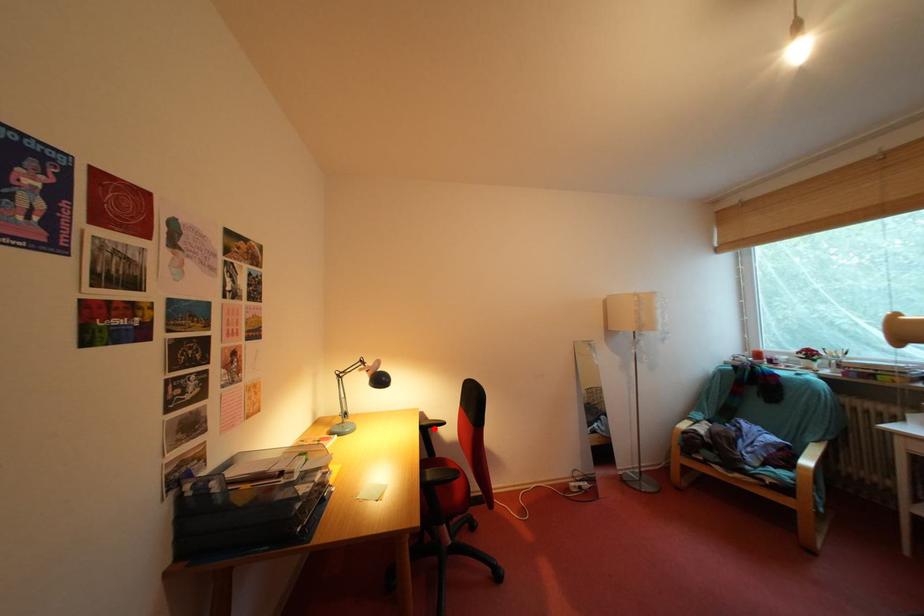
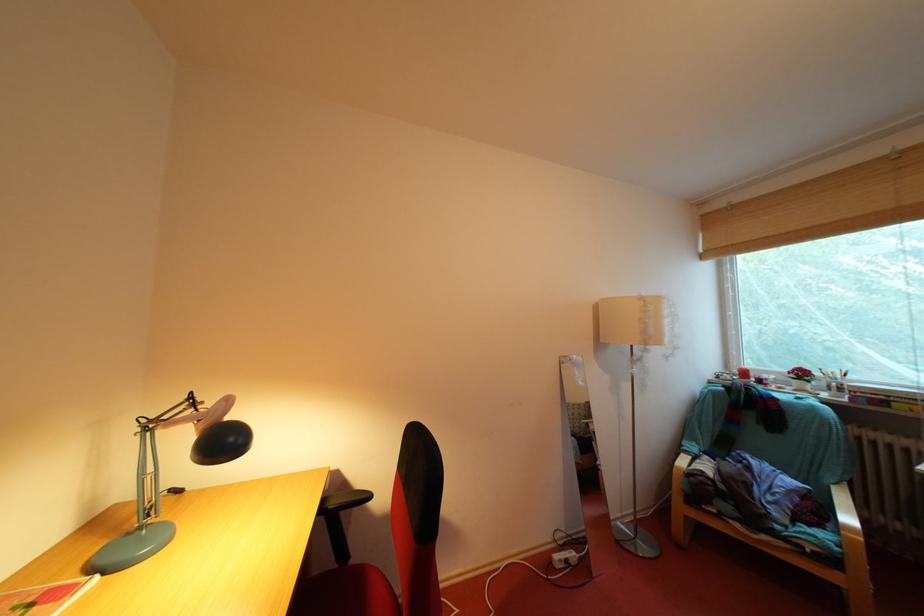
Question: I am providing you with two images of the same scene from different viewpoints. Given a red point in image1, look at the same physical point in image2. Is it:

Choices:
 (A) Closer to the viewpoint
 (B) Farther from the viewpoint

Answer: (A)